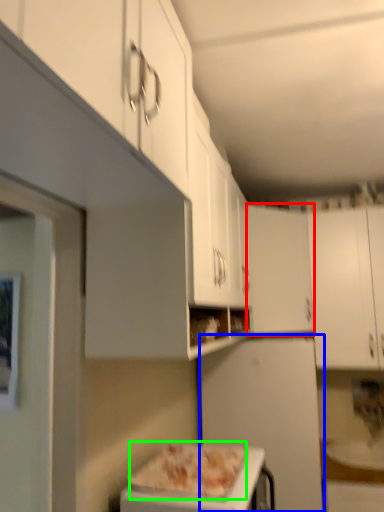
Question: Estimate the real-world distances between objects in this image. Which object is farther from cabinetry (highlighted by a red box), appliance (highlighted by a blue box) or pizza (highlighted by a green box)?

Choices:
 (A) appliance
 (B) pizza

Answer: (B)